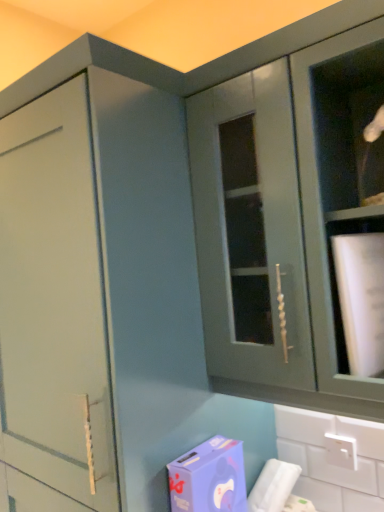
Question: Is matte green cabinet at upper right wider than purple matte cardboard box at lower center?

Choices:
 (A) no
 (B) yes

Answer: (B)

Question: Is purple matte cardboard box at lower center inside matte green cabinet at upper right?

Choices:
 (A) no
 (B) yes

Answer: (A)

Question: Is matte green cabinet at upper right at the left side of purple matte cardboard box at lower center?

Choices:
 (A) no
 (B) yes

Answer: (A)

Question: Is matte green cabinet at upper right looking in the opposite direction of purple matte cardboard box at lower center?

Choices:
 (A) no
 (B) yes

Answer: (A)

Question: Can you confirm if matte green cabinet at upper right is bigger than purple matte cardboard box at lower center?

Choices:
 (A) yes
 (B) no

Answer: (A)

Question: Is matte green cabinet at upper right outside purple matte cardboard box at lower center?

Choices:
 (A) yes
 (B) no

Answer: (A)

Question: Does purple matte cardboard box at lower center have a lesser height compared to matte green cabinet at upper right?

Choices:
 (A) no
 (B) yes

Answer: (B)

Question: Does purple matte cardboard box at lower center appear on the right side of matte green cabinet at upper right?

Choices:
 (A) no
 (B) yes

Answer: (A)

Question: Is purple matte cardboard box at lower center thinner than matte green cabinet at upper right?

Choices:
 (A) no
 (B) yes

Answer: (B)

Question: From the image's perspective, is purple matte cardboard box at lower center over matte green cabinet at upper right?

Choices:
 (A) no
 (B) yes

Answer: (A)

Question: Is matte green cabinet at upper right a part of purple matte cardboard box at lower center?

Choices:
 (A) yes
 (B) no

Answer: (B)

Question: From a real-world perspective, does purple matte cardboard box at lower center stand above matte green cabinet at upper right?

Choices:
 (A) no
 (B) yes

Answer: (A)

Question: Looking at their shapes, would you say purple matte cardboard box at lower center is wider or thinner than matte green cabinet at upper right?

Choices:
 (A) wide
 (B) thin

Answer: (B)